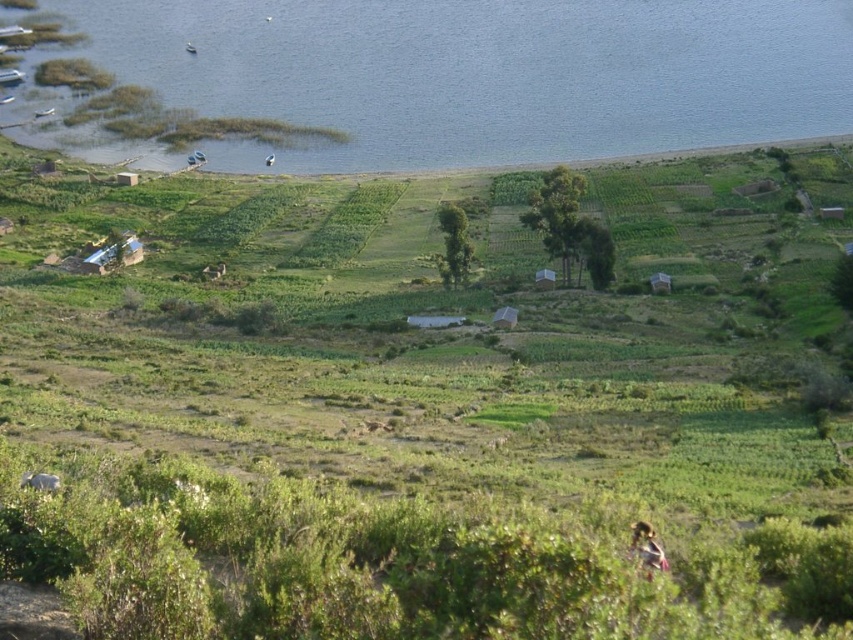
Identify the location of blue water at upper left. (485, 72).

Who is more distant from viewer, (318, 67) or (663, 556)?

The point (318, 67) is behind.

The height and width of the screenshot is (640, 853). Identify the location of blue water at upper left. (485, 72).

At what (x,y) coordinates should I click in order to perform the action: click on blue water at upper left. Please return your answer as a coordinate pair (x, y). The width and height of the screenshot is (853, 640). Looking at the image, I should click on (x=485, y=72).